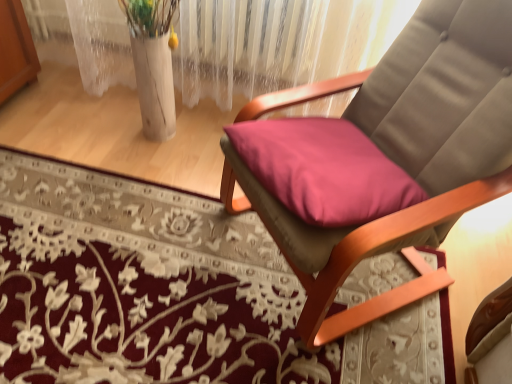
What do you see at coordinates (170, 293) in the screenshot? I see `floral carpet at center` at bounding box center [170, 293].

Find the location of a particular element. The height and width of the screenshot is (384, 512). floral carpet at center is located at coordinates point(170,293).

What do you see at coordinates (402, 153) in the screenshot?
I see `matte pink cushion at center` at bounding box center [402, 153].

Identify the location of matte pink cushion at center. (402, 153).

The image size is (512, 384). Find the location of `floral carpet at center`. floral carpet at center is located at coordinates (170, 293).

Considering the relative positions of floral carpet at center and matte pink cushion at center in the image provided, is floral carpet at center to the left or to the right of matte pink cushion at center?

floral carpet at center is to the left of matte pink cushion at center.

Who is more distant, floral carpet at center or matte pink cushion at center?

floral carpet at center is more distant.

Which point is more distant from viewer, [347,350] or [304,306]?

Point [347,350]

From the image's perspective, which is below, floral carpet at center or matte pink cushion at center?

floral carpet at center is shown below in the image.

From a real-world perspective, which is physically below, floral carpet at center or matte pink cushion at center?

From a 3D spatial view, floral carpet at center is below.

Considering the sizes of objects floral carpet at center and matte pink cushion at center in the image provided, who is wider, floral carpet at center or matte pink cushion at center?

Wider between the two is floral carpet at center.

Who is shorter, floral carpet at center or matte pink cushion at center?

With less height is floral carpet at center.

Considering the sizes of objects floral carpet at center and matte pink cushion at center in the image provided, who is bigger, floral carpet at center or matte pink cushion at center?

With larger size is matte pink cushion at center.

Is floral carpet at center inside or outside of matte pink cushion at center?

floral carpet at center lies outside matte pink cushion at center.

Is floral carpet at center far from matte pink cushion at center?

No, floral carpet at center is not far away from matte pink cushion at center.

In the scene shown: Is floral carpet at center oriented towards matte pink cushion at center?

Yes, floral carpet at center is aimed at matte pink cushion at center.

How far apart are floral carpet at center and matte pink cushion at center?

17.61 inches.

There is a floral carpet at center. Identify the location of chair above it (from a real-world perspective). The width and height of the screenshot is (512, 384). (402, 153).

Which is more to the left, matte pink cushion at center or floral carpet at center?

floral carpet at center.

Is matte pink cushion at center further to camera compared to floral carpet at center?

No, the depth of matte pink cushion at center is less than that of floral carpet at center.

Considering the positions of point (484, 5) and point (420, 336), is point (484, 5) closer or farther from the camera than point (420, 336)?

Point (484, 5) appears to be closer to the viewer than point (420, 336).

From the image's perspective, is matte pink cushion at center located above or below floral carpet at center?

From the image's perspective, matte pink cushion at center appears above floral carpet at center.

From a real-world perspective, which is physically below, matte pink cushion at center or floral carpet at center?

floral carpet at center is physically lower.

Which of these two, matte pink cushion at center or floral carpet at center, is thinner?

Thinner between the two is matte pink cushion at center.

Can you confirm if matte pink cushion at center is shorter than floral carpet at center?

No, matte pink cushion at center is not shorter than floral carpet at center.

Based on their sizes in the image, would you say matte pink cushion at center is bigger or smaller than floral carpet at center?

In the image, matte pink cushion at center appears to be larger than floral carpet at center.

Is matte pink cushion at center positioned beyond the bounds of floral carpet at center?

Yes, matte pink cushion at center is located beyond the bounds of floral carpet at center.

Is the surface of matte pink cushion at center in direct contact with floral carpet at center?

There is a gap between matte pink cushion at center and floral carpet at center.

Is matte pink cushion at center oriented towards floral carpet at center?

Yes, matte pink cushion at center faces towards floral carpet at center.

The image size is (512, 384). In order to click on chair that is above the floral carpet at center (from a real-world perspective) in this screenshot , I will do `click(402, 153)`.

Where is `mat below the matte pink cushion at center (from a real-world perspective)`? The width and height of the screenshot is (512, 384). mat below the matte pink cushion at center (from a real-world perspective) is located at coordinates (170, 293).

Locate an element on the screen. The image size is (512, 384). chair on the right of floral carpet at center is located at coordinates (402, 153).